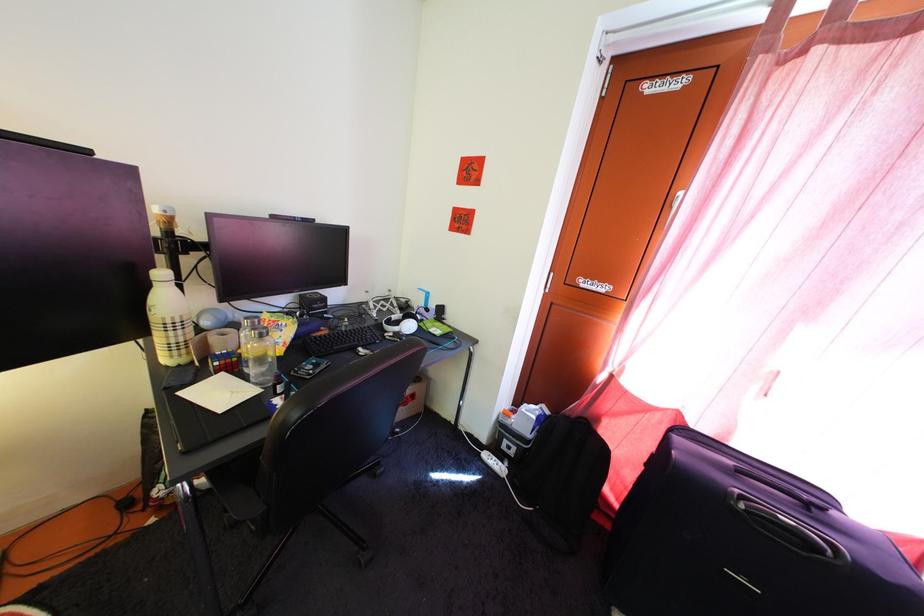
This screenshot has height=616, width=924. Describe the element at coordinates (789, 535) in the screenshot. I see `the black suitcase handle` at that location.